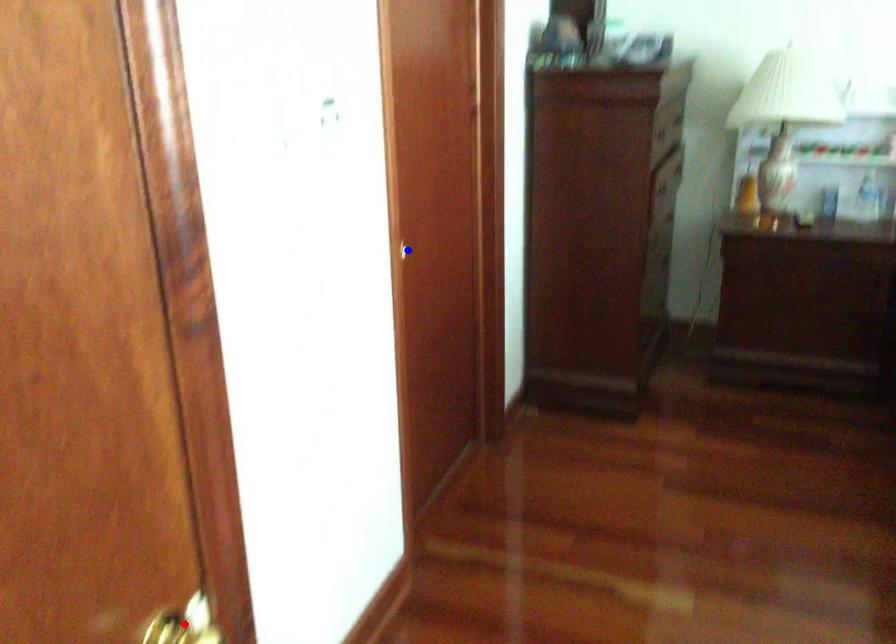
Question: Two points are marked on the image. Which point is closer to the camera?

Choices:
 (A) Blue point is closer.
 (B) Red point is closer.

Answer: (B)